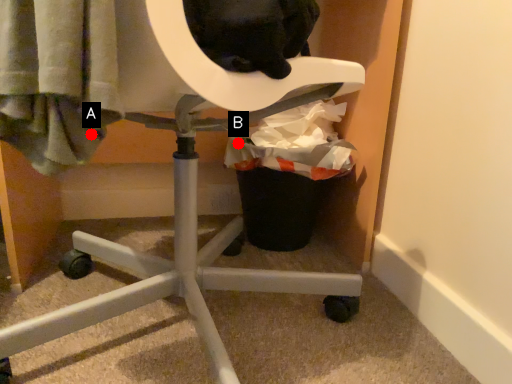
Question: Two points are circled on the image, labeled by A and B beside each circle. Which of the following is the farthest from the observer?

Choices:
 (A) A is further
 (B) B is further

Answer: (B)